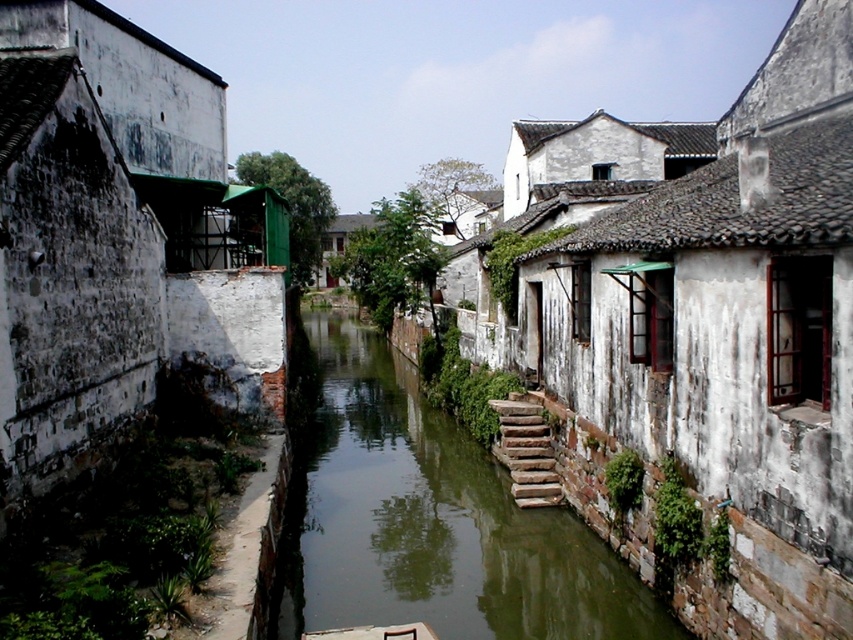
Can you confirm if green mossy stone at center is taller than stone steps at center?

Indeed, green mossy stone at center has a greater height compared to stone steps at center.

Does point (364, 504) lie in front of point (524, 488)?

That is False.

Which is behind, point (351, 451) or point (517, 419)?

The point (351, 451) is behind.

What are the coordinates of `green mossy stone at center` in the screenshot? It's located at (428, 518).